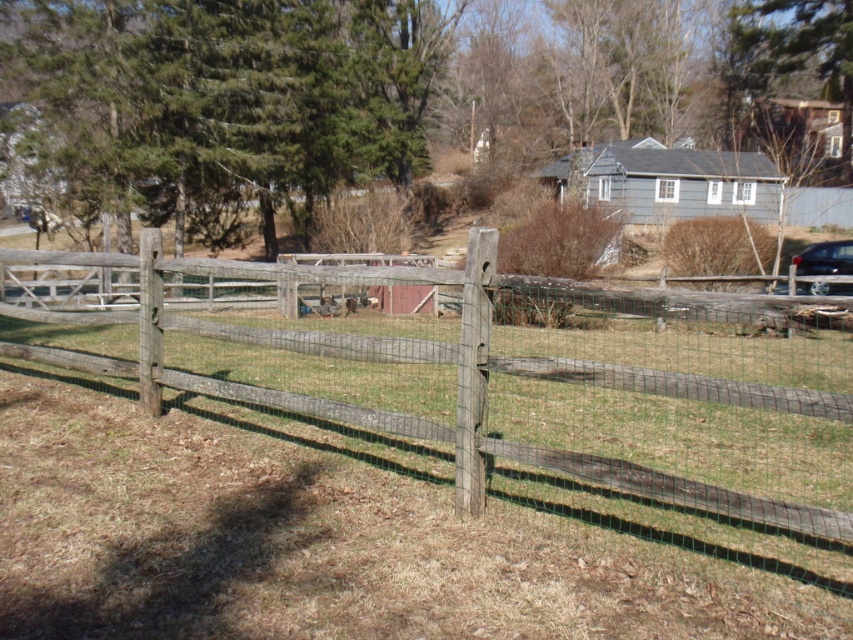
Question: Considering the relative positions of weathered wood fence at center and shiny black car at right in the image provided, where is weathered wood fence at center located with respect to shiny black car at right?

Choices:
 (A) above
 (B) below

Answer: (B)

Question: Which point is farther to the camera?

Choices:
 (A) (793, 400)
 (B) (845, 260)

Answer: (B)

Question: Which of the following is the farthest from the observer?

Choices:
 (A) (820, 244)
 (B) (636, 532)

Answer: (A)

Question: Is weathered wood fence at center positioned behind shiny black car at right?

Choices:
 (A) no
 (B) yes

Answer: (A)

Question: Does weathered wood fence at center appear on the left side of shiny black car at right?

Choices:
 (A) yes
 (B) no

Answer: (A)